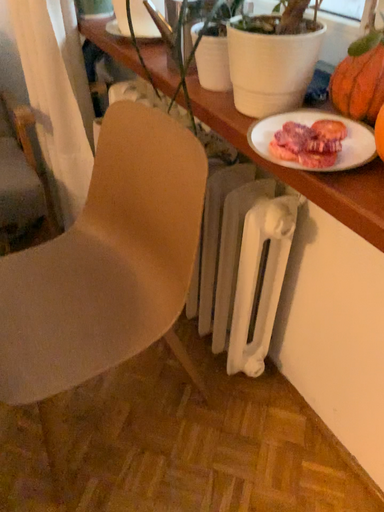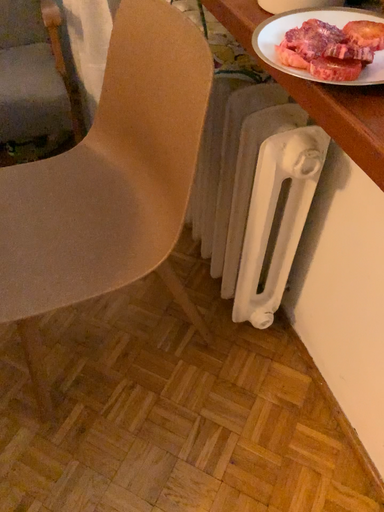
Question: Which way did the camera rotate in the video?

Choices:
 (A) rotated right
 (B) rotated left

Answer: (B)